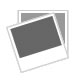
Find the location of `grey picture`. grey picture is located at coordinates (62, 25).